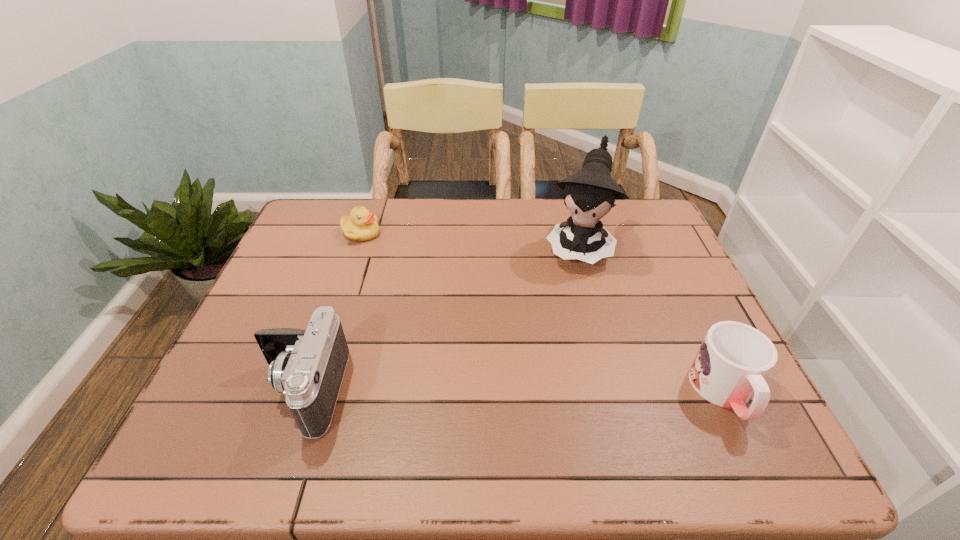
At what (x,y) coordinates should I click in order to perform the action: click on the closest object to the third tallest object. Please return your answer as a coordinate pair (x, y). The image size is (960, 540). Looking at the image, I should click on (590, 194).